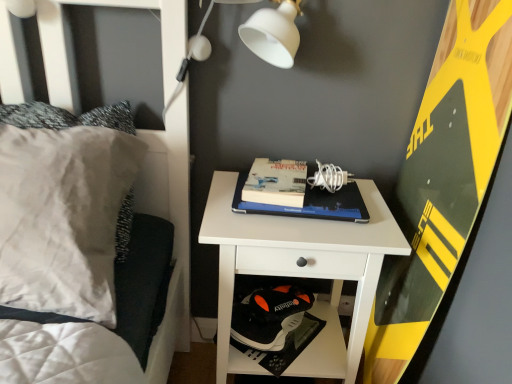
Where is `vacant area that lies in front of hardcover book at center, which is counted as the 2th paperback book, starting from the left`? Image resolution: width=512 pixels, height=384 pixels. vacant area that lies in front of hardcover book at center, which is counted as the 2th paperback book, starting from the left is located at coordinates (300, 234).